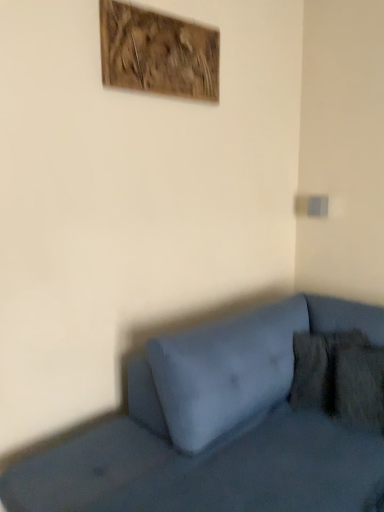
This screenshot has height=512, width=384. Describe the element at coordinates (218, 428) in the screenshot. I see `matte blue couch at lower right` at that location.

Measure the distance between wooden textured artwork at upper center and camera.

wooden textured artwork at upper center and camera are 5.85 feet apart from each other.

What do you see at coordinates (158, 53) in the screenshot? I see `wooden textured artwork at upper center` at bounding box center [158, 53].

What are the coordinates of `matte blue couch at lower right` in the screenshot? It's located at (218, 428).

Is matte blue couch at lower right aimed at wooden textured artwork at upper center?

No, matte blue couch at lower right is not facing towards wooden textured artwork at upper center.

Based on the photo, does matte blue couch at lower right have a lesser height compared to wooden textured artwork at upper center?

In fact, matte blue couch at lower right may be taller than wooden textured artwork at upper center.

Considering the positions of objects matte blue couch at lower right and wooden textured artwork at upper center in the image provided, who is in front, matte blue couch at lower right or wooden textured artwork at upper center?

matte blue couch at lower right is more forward.

The height and width of the screenshot is (512, 384). Identify the location of pillow behind the wooden textured artwork at upper center. (339, 377).

Is velvety brown pillow at lower right to the left or to the right of wooden textured artwork at upper center in the image?

In the image, velvety brown pillow at lower right appears on the right side of wooden textured artwork at upper center.

Can you confirm if velvety brown pillow at lower right is bigger than wooden textured artwork at upper center?

Yes, velvety brown pillow at lower right is bigger than wooden textured artwork at upper center.

Is velvety brown pillow at lower right in contact with wooden textured artwork at upper center?

They are not placed beside each other.

You are a GUI agent. You are given a task and a screenshot of the screen. Output one action in this format:
    pyautogui.click(x=<x>, y=<y>)
    Task: Click on the studio couch that is in front of the velvety brown pillow at lower right
    The width and height of the screenshot is (384, 512).
    Given the screenshot: What is the action you would take?
    pyautogui.click(x=218, y=428)

Is velvety brown pillow at lower right facing towards matte blue couch at lower right?

Yes, velvety brown pillow at lower right is turned towards matte blue couch at lower right.

In terms of width, does velvety brown pillow at lower right look wider or thinner when compared to matte blue couch at lower right?

Clearly, velvety brown pillow at lower right has less width compared to matte blue couch at lower right.

Which of these two, velvety brown pillow at lower right or matte blue couch at lower right, is smaller?

velvety brown pillow at lower right is smaller.

Is wooden textured artwork at upper center inside or outside of matte blue couch at lower right?

wooden textured artwork at upper center is not inside matte blue couch at lower right, it's outside.

Is wooden textured artwork at upper center directly adjacent to matte blue couch at lower right?

No, wooden textured artwork at upper center is not touching matte blue couch at lower right.

From a real-world perspective, is wooden textured artwork at upper center under matte blue couch at lower right?

No, from a real-world perspective, wooden textured artwork at upper center is not below matte blue couch at lower right.

How different are the orientations of wooden textured artwork at upper center and matte blue couch at lower right in degrees?

They differ by 87.6 degrees in their facing directions.

How far apart are matte blue couch at lower right and velvety brown pillow at lower right?

A distance of 10.96 inches exists between matte blue couch at lower right and velvety brown pillow at lower right.

In the image, is matte blue couch at lower right positioned in front of or behind velvety brown pillow at lower right?

matte blue couch at lower right is in front of velvety brown pillow at lower right.

Considering the sizes of objects matte blue couch at lower right and velvety brown pillow at lower right in the image provided, who is wider, matte blue couch at lower right or velvety brown pillow at lower right?

With larger width is matte blue couch at lower right.

Which object is positioned more to the left, matte blue couch at lower right or velvety brown pillow at lower right?

matte blue couch at lower right.

From the image's perspective, between wooden textured artwork at upper center and velvety brown pillow at lower right, who is located below?

velvety brown pillow at lower right is shown below in the image.

From a real-world perspective, which is physically above, wooden textured artwork at upper center or velvety brown pillow at lower right?

In real-world perspective, wooden textured artwork at upper center is above.

Relative to velvety brown pillow at lower right, is wooden textured artwork at upper center in front or behind?

In the image, wooden textured artwork at upper center appears in front of velvety brown pillow at lower right.

The image size is (384, 512). I want to click on picture frame behind the matte blue couch at lower right, so coord(158,53).

Find the location of a particular element. The height and width of the screenshot is (512, 384). picture frame located in front of the velvety brown pillow at lower right is located at coordinates (158, 53).

From the image, which object appears to be farther from wooden textured artwork at upper center, velvety brown pillow at lower right or matte blue couch at lower right?

Based on the image, velvety brown pillow at lower right appears to be further to wooden textured artwork at upper center.

Considering their positions, is velvety brown pillow at lower right positioned closer to matte blue couch at lower right than wooden textured artwork at upper center?

The object closer to matte blue couch at lower right is velvety brown pillow at lower right.

Which object lies further to the anchor point velvety brown pillow at lower right, wooden textured artwork at upper center or matte blue couch at lower right?

Based on the image, wooden textured artwork at upper center appears to be further to velvety brown pillow at lower right.

Which object lies further to the anchor point velvety brown pillow at lower right, matte blue couch at lower right or wooden textured artwork at upper center?

wooden textured artwork at upper center lies further to velvety brown pillow at lower right than the other object.

Looking at the image, which one is located closer to wooden textured artwork at upper center, matte blue couch at lower right or velvety brown pillow at lower right?

matte blue couch at lower right lies closer to wooden textured artwork at upper center than the other object.

Looking at this image, based on their spatial positions, is wooden textured artwork at upper center or velvety brown pillow at lower right further from matte blue couch at lower right?

Among the two, wooden textured artwork at upper center is located further to matte blue couch at lower right.

You are a GUI agent. You are given a task and a screenshot of the screen. Output one action in this format:
    pyautogui.click(x=<x>, y=<y>)
    Task: Click on the pillow that lies between wooden textured artwork at upper center and matte blue couch at lower right from top to bottom
    The width and height of the screenshot is (384, 512).
    Given the screenshot: What is the action you would take?
    point(339,377)